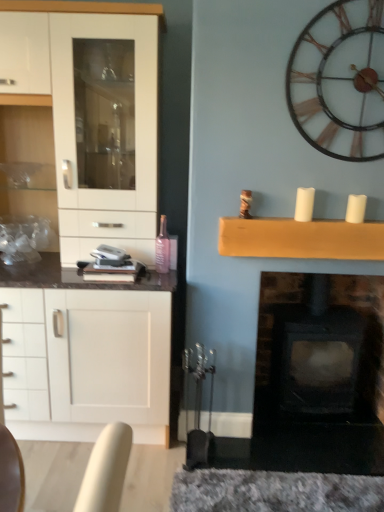
Question: From a real-world perspective, is pink glass bottle at center below white matte candle at upper right, which appears as the first candle when viewed from the right?

Choices:
 (A) yes
 (B) no

Answer: (A)

Question: Does pink glass bottle at center come in front of white matte candle at upper right, positioned as the 2th candle in left-to-right order?

Choices:
 (A) no
 (B) yes

Answer: (A)

Question: Does pink glass bottle at center appear on the left side of white matte candle at upper right, which appears as the first candle when viewed from the right?

Choices:
 (A) no
 (B) yes

Answer: (B)

Question: Considering the relative sizes of pink glass bottle at center and white matte candle at upper right, positioned as the 2th candle in left-to-right order, in the image provided, is pink glass bottle at center smaller than white matte candle at upper right, positioned as the 2th candle in left-to-right order,?

Choices:
 (A) no
 (B) yes

Answer: (A)

Question: Is pink glass bottle at center touching white matte candle at upper right, positioned as the 2th candle in left-to-right order?

Choices:
 (A) yes
 (B) no

Answer: (B)

Question: From a real-world perspective, is metallic brown clock at upper right above or below wooden mantle at upper center?

Choices:
 (A) above
 (B) below

Answer: (A)

Question: Considering the relative positions of metallic brown clock at upper right and wooden mantle at upper center in the image provided, is metallic brown clock at upper right to the left or to the right of wooden mantle at upper center?

Choices:
 (A) right
 (B) left

Answer: (A)

Question: Is metallic brown clock at upper right taller or shorter than wooden mantle at upper center?

Choices:
 (A) short
 (B) tall

Answer: (B)

Question: Is metallic brown clock at upper right wider or thinner than wooden mantle at upper center?

Choices:
 (A) thin
 (B) wide

Answer: (A)

Question: Considering the positions of pink glass bottle at center and metallic brown clock at upper right in the image, is pink glass bottle at center taller or shorter than metallic brown clock at upper right?

Choices:
 (A) tall
 (B) short

Answer: (B)

Question: In terms of width, does pink glass bottle at center look wider or thinner when compared to metallic brown clock at upper right?

Choices:
 (A) thin
 (B) wide

Answer: (B)

Question: From a real-world perspective, is pink glass bottle at center above or below metallic brown clock at upper right?

Choices:
 (A) below
 (B) above

Answer: (A)

Question: From the image's perspective, relative to metallic brown clock at upper right, is pink glass bottle at center above or below?

Choices:
 (A) above
 (B) below

Answer: (B)

Question: Considering their positions, is white matte candle at upper center, marked as the second candle in a right-to-left arrangement, located in front of or behind white matte candle at upper right, positioned as the 2th candle in left-to-right order?

Choices:
 (A) front
 (B) behind

Answer: (A)

Question: From a real-world perspective, is white matte candle at upper center, the 1th candle from the left, physically located above or below white matte candle at upper right, positioned as the 2th candle in left-to-right order?

Choices:
 (A) below
 (B) above

Answer: (B)